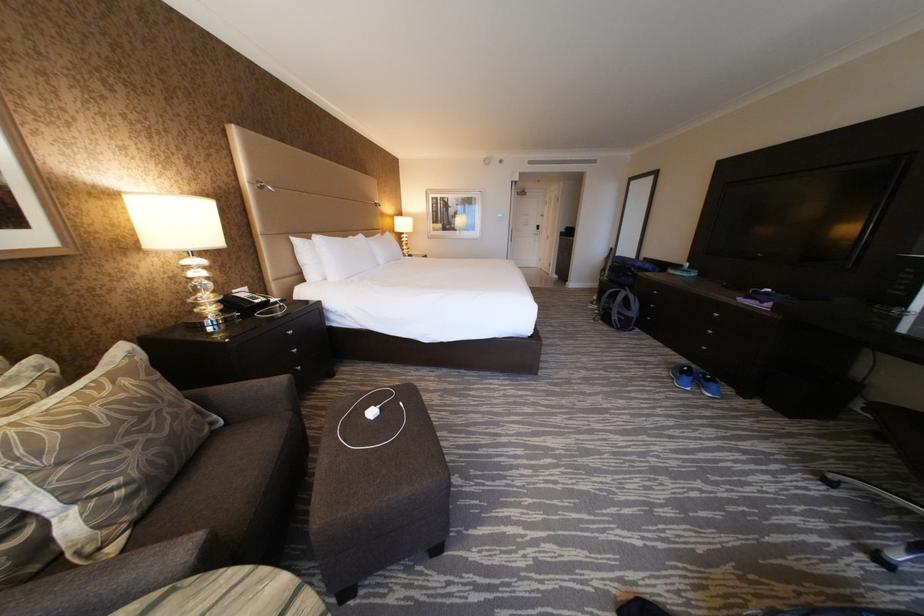
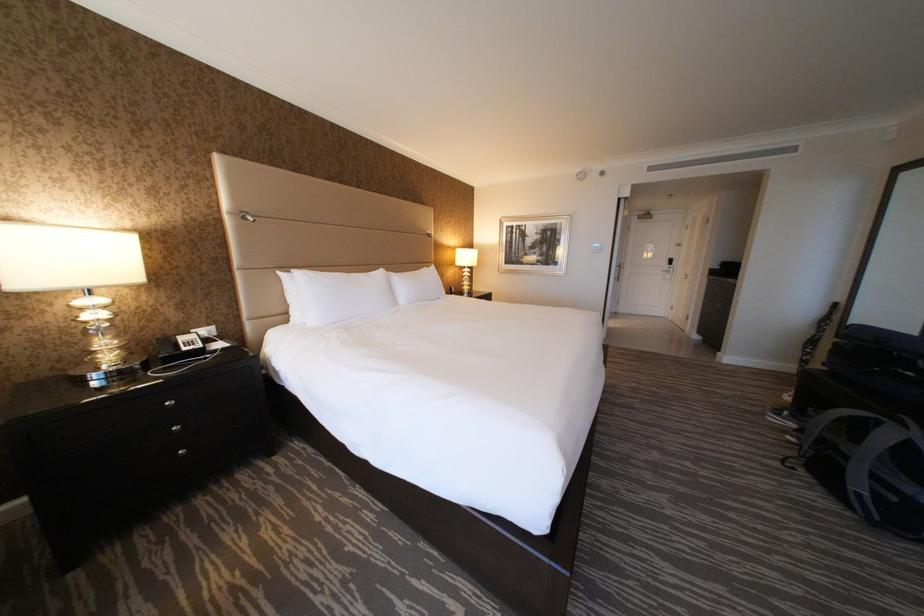
In a continuous first-person perspective shot, in which direction is the camera moving?

The movement direction of the cameraman is right, forward.